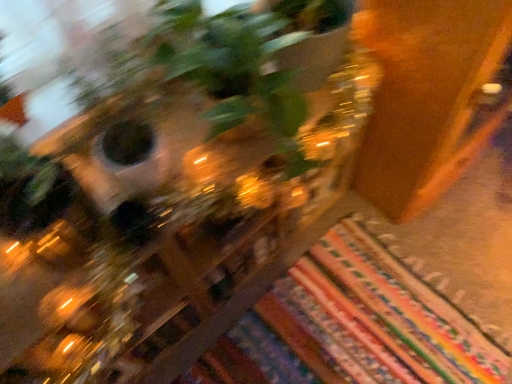
Locate an element on the screen. The width and height of the screenshot is (512, 384). multicolored woven mat at lower right is located at coordinates (354, 325).

What do you see at coordinates (354, 325) in the screenshot? I see `multicolored woven mat at lower right` at bounding box center [354, 325].

In order to click on multicolored woven mat at lower right in this screenshot , I will do `click(354, 325)`.